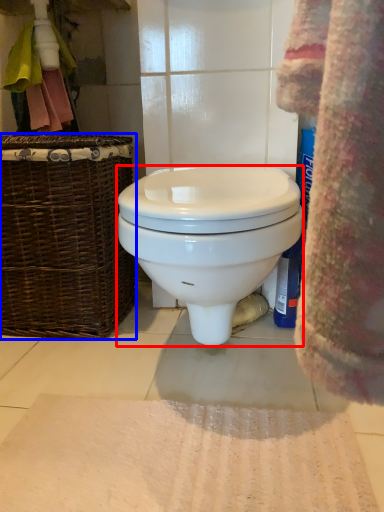
Question: Which of the following is the farthest to the observer, toilet (highlighted by a red box) or picnic basket (highlighted by a blue box)?

Choices:
 (A) toilet
 (B) picnic basket

Answer: (B)